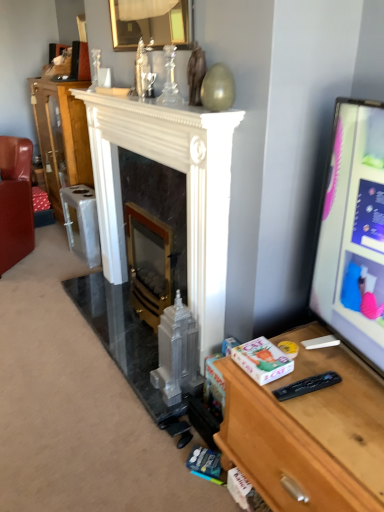
Image resolution: width=384 pixels, height=512 pixels. What are the coordinates of `free spot below matte black monitor at right (from a real-world perspective)` in the screenshot? It's located at (345, 370).